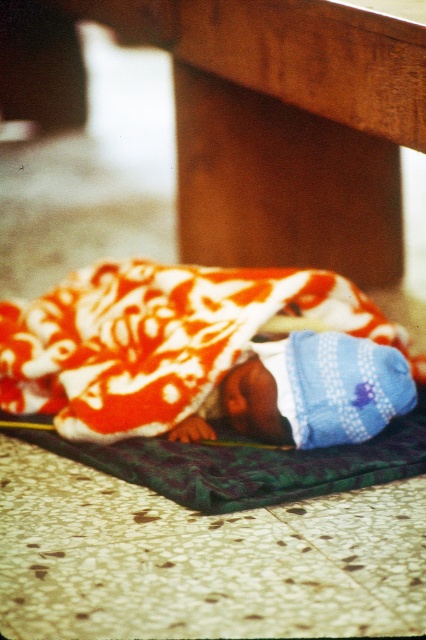
Question: Which point is farther to the camera?

Choices:
 (A) tap(310, 422)
 (B) tap(207, 26)
 (C) tap(5, 324)

Answer: (B)

Question: Which object appears farthest from the camera in this image?

Choices:
 (A) brown wood table at lower center
 (B) floral cotton blanket at lower center
 (C) blue knitted hat at lower center

Answer: (B)

Question: Is brown wood table at lower center to the right of blue knitted hat at lower center from the viewer's perspective?

Choices:
 (A) yes
 (B) no

Answer: (B)

Question: From the image, what is the correct spatial relationship of brown wood table at lower center in relation to blue knitted hat at lower center?

Choices:
 (A) below
 (B) above

Answer: (B)

Question: Which of these objects is positioned closest to the floral cotton blanket at lower center?

Choices:
 (A) brown wood table at lower center
 (B) blue knitted hat at lower center

Answer: (B)

Question: Considering the relative positions of brown wood table at lower center and floral cotton blanket at lower center in the image provided, where is brown wood table at lower center located with respect to floral cotton blanket at lower center?

Choices:
 (A) left
 (B) right

Answer: (B)